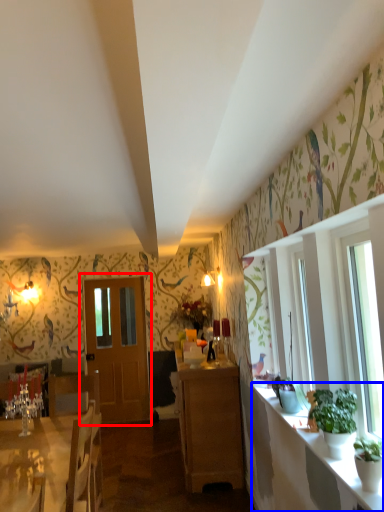
Question: Which object is closer to the camera taking this photo, door (highlighted by a red box) or counter top (highlighted by a blue box)?

Choices:
 (A) door
 (B) counter top

Answer: (B)